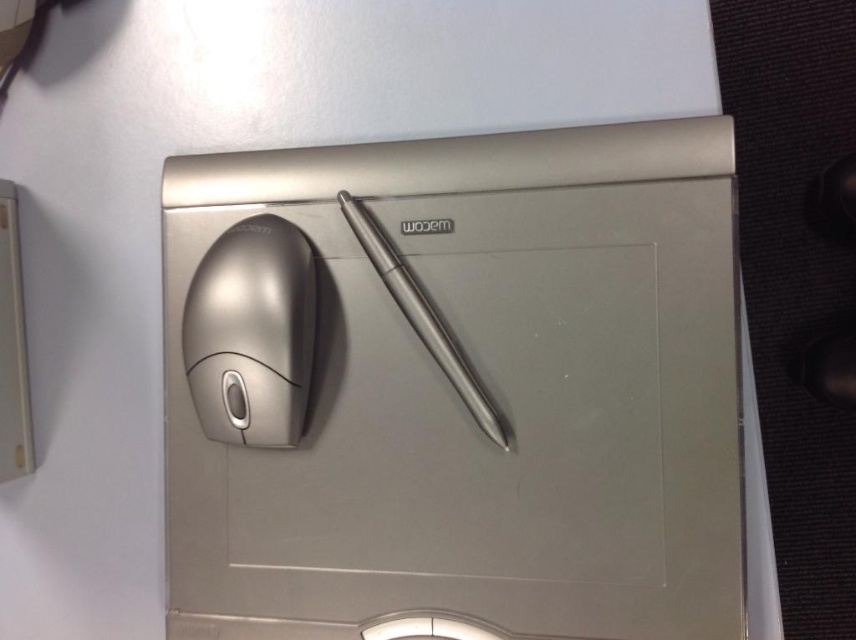
You are a graphic designer who needs to place a new stylus pen on the metallic surface. The existing satin silver mouse at left is already placed at point 0.522, 0.294. Where should you place the new stylus pen to ensure it doesn not overlap with the mouse?

The satin silver mouse at left is located at coordinates [251,333]. To avoid overlapping, place the new stylus pen in an area of the metallic surface that does not intersect with these coordinates.

You are setting up a workspace and need to choose between two satin silver mice. The satin silver mouse at center and the satin silver mouse at left are both on the metallic surface. Which one should you pick if you prefer a larger mouse for better grip?

The satin silver mouse at center is larger in size than the satin silver mouse at left, so you should pick the satin silver mouse at center for better grip.

You have a small container that can only hold items narrower than 5 centimeters. You need to place either the satin silver mouse at left or the satin silver pen at center into it. Based on their widths, which one can fit inside the container?

The satin silver mouse at left has a width less than the satin silver pen at center, so the satin silver mouse at left can fit inside the container since it is narrower than 5 centimeters.